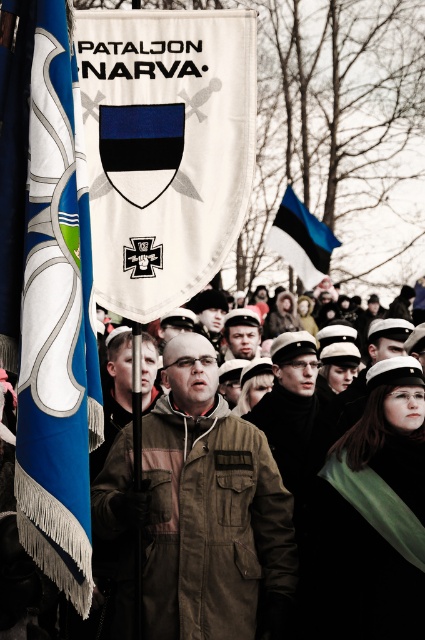
Is brown suede jacket at center above blue fringed flag at left?

No.

Measure the distance between brown suede jacket at center and camera.

The distance of brown suede jacket at center from camera is 93.37 feet.

Which is in front, point (192, 508) or point (48, 243)?

Positioned in front is point (48, 243).

You are a GUI agent. You are given a task and a screenshot of the screen. Output one action in this format:
    pyautogui.click(x=<x>, y=<y>)
    Task: Click on the brown suede jacket at center
    
    Given the screenshot: What is the action you would take?
    pyautogui.click(x=201, y=509)

Does blue-white-black flag at upper right appear on the right side of matte black uniform at center?

Indeed, blue-white-black flag at upper right is positioned on the right side of matte black uniform at center.

Can you confirm if blue-white-black flag at upper right is positioned above matte black uniform at center?

Indeed, blue-white-black flag at upper right is positioned over matte black uniform at center.

Is point (308, 227) closer to camera compared to point (251, 333)?

No, (308, 227) is further to viewer.

The width and height of the screenshot is (425, 640). In order to click on blue-white-black flag at upper right in this screenshot , I will do `click(302, 240)`.

Between brown suede jacket at center and blue-white-black flag at upper right, which one appears on the right side from the viewer's perspective?

blue-white-black flag at upper right

Is point (184, 400) more distant than point (322, 257)?

No.

This screenshot has height=640, width=425. I want to click on brown suede jacket at center, so click(x=201, y=509).